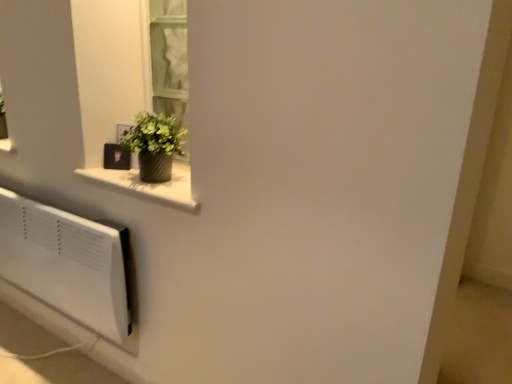
Question: Considering the positions of textured gray vase at upper left and green textured vase at upper left in the image, is textured gray vase at upper left wider or thinner than green textured vase at upper left?

Choices:
 (A) wide
 (B) thin

Answer: (A)

Question: From their relative heights in the image, would you say textured gray vase at upper left is taller or shorter than green textured vase at upper left?

Choices:
 (A) tall
 (B) short

Answer: (B)

Question: Does point (159, 195) appear closer or farther from the camera than point (163, 125)?

Choices:
 (A) farther
 (B) closer

Answer: (B)

Question: Is point (154, 182) closer or farther from the camera than point (183, 170)?

Choices:
 (A) farther
 (B) closer

Answer: (B)

Question: From the image's perspective, is green textured vase at upper left above or below textured gray vase at upper left?

Choices:
 (A) below
 (B) above

Answer: (B)

Question: Based on their positions, is green textured vase at upper left located to the left or right of textured gray vase at upper left?

Choices:
 (A) right
 (B) left

Answer: (B)

Question: Choose the correct answer: Is green textured vase at upper left inside textured gray vase at upper left or outside it?

Choices:
 (A) outside
 (B) inside

Answer: (A)